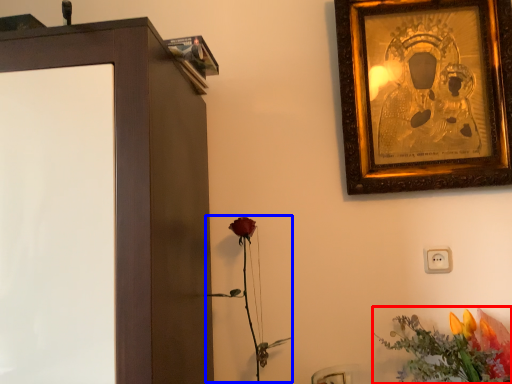
Question: Among these objects, which one is nearest to the camera, flower (highlighted by a red box) or plant (highlighted by a blue box)?

Choices:
 (A) flower
 (B) plant

Answer: (A)